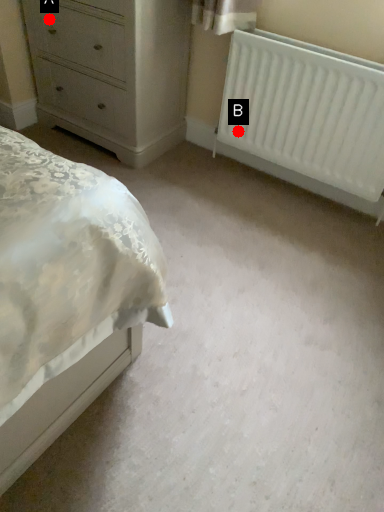
Question: Two points are circled on the image, labeled by A and B beside each circle. Which of the following is the farthest from the observer?

Choices:
 (A) A is further
 (B) B is further

Answer: (B)